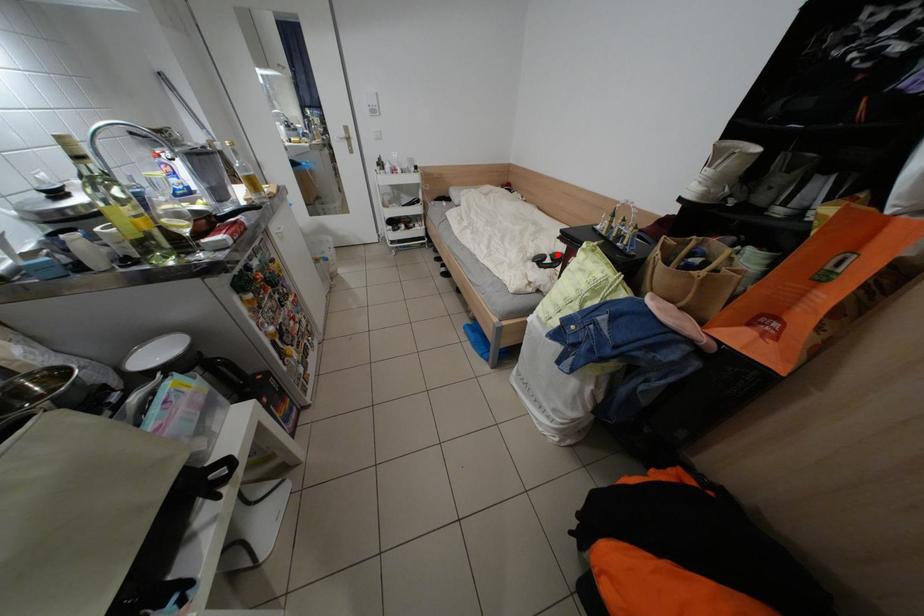
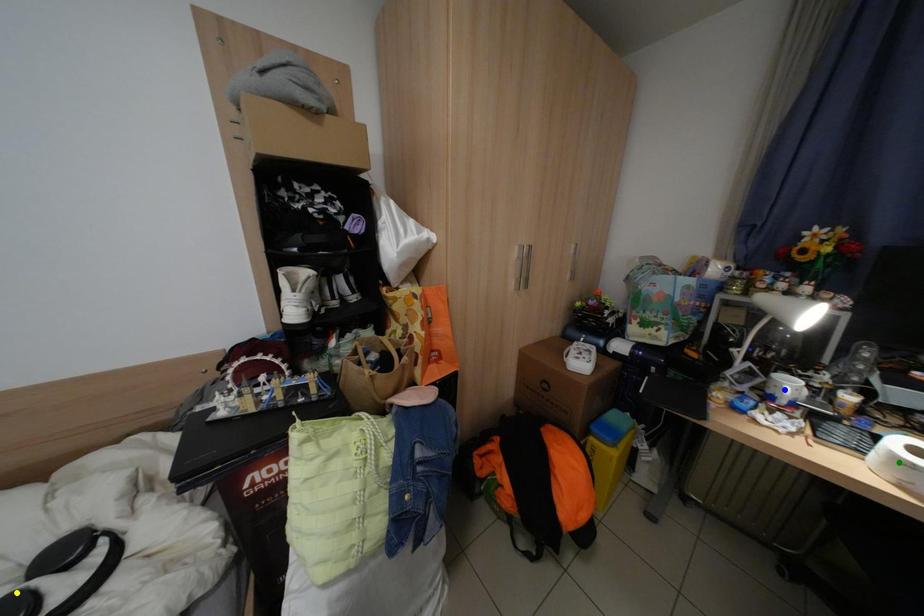
Question: I am providing you with two images of the same scene from different viewpoints. A red point is marked on the first image. You are given multiple points on the second image. Which mark in image 2 goes with the point in image 1?

Choices:
 (A) blue point
 (B) green point
 (C) yellow point

Answer: (C)